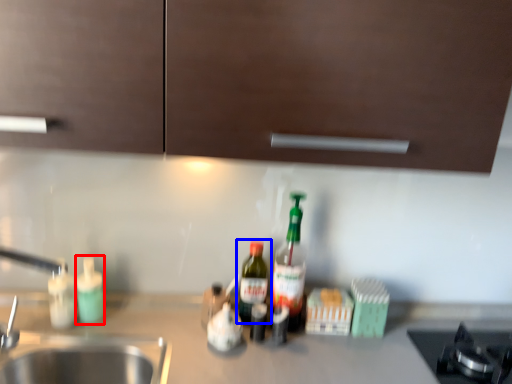
Question: Which point is further to the camera, bottle (highlighted by a red box) or bottle (highlighted by a blue box)?

Choices:
 (A) bottle
 (B) bottle

Answer: (B)